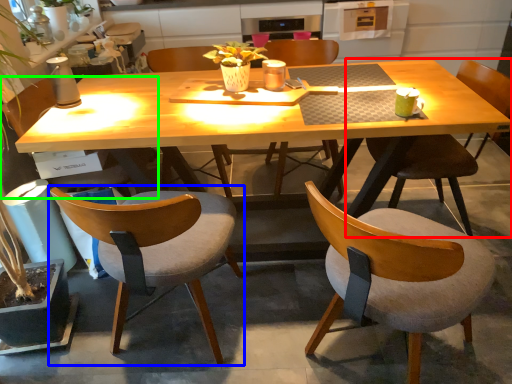
Question: Which object is positioned closest to chair (highlighted by a red box)? Select from chair (highlighted by a blue box) and chair (highlighted by a green box).

Choices:
 (A) chair
 (B) chair

Answer: (A)